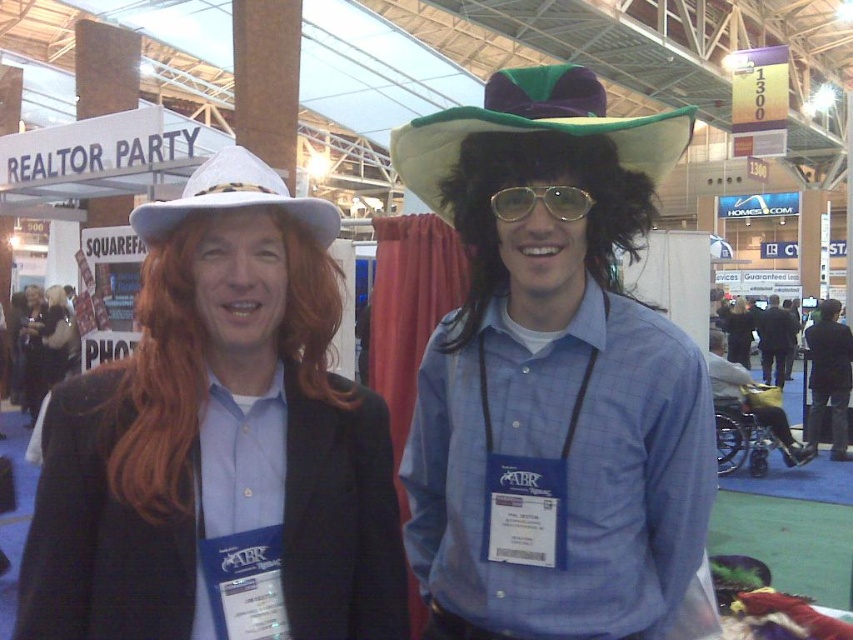
You are standing at the point marked as point (370, 484) in the convention hall. You need to walk to the nearest exit, which is located 5 feet away from your current position. Can you safely reach the exit without moving more than 5 feet?

The distance of point (370, 484) from camera is 4.64 feet, so yes, you can safely reach the exit since the required distance is within the 5 feet limit.

What are the coordinates of the green felt cowboy hat at center?

The green felt cowboy hat at center is located at coordinates point (534, 128).

You are at a convention and need to locate the white fabric cowboy hat at upper left. According to the coordinates provided, where exactly is it positioned?

The white fabric cowboy hat at upper left is located at coordinates point [234,196].